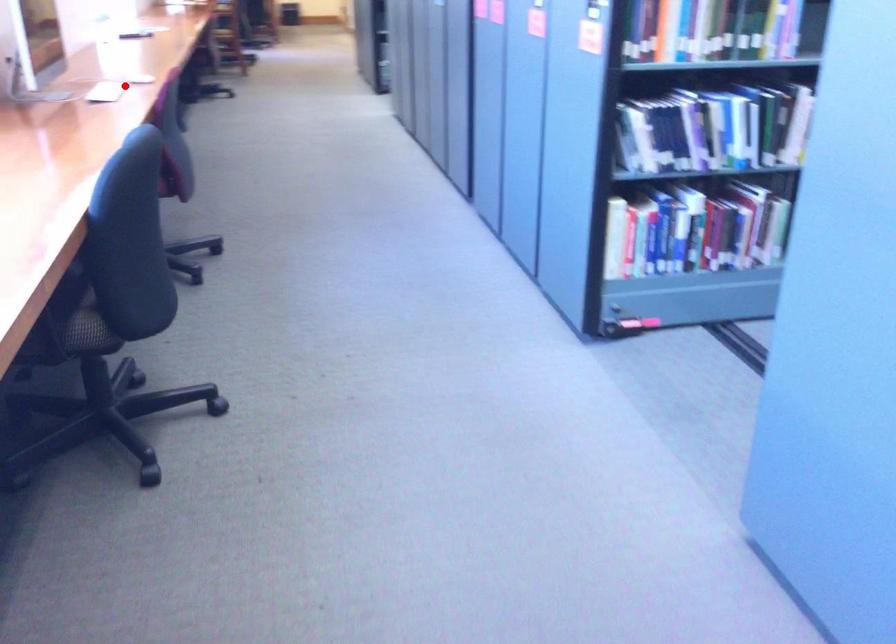
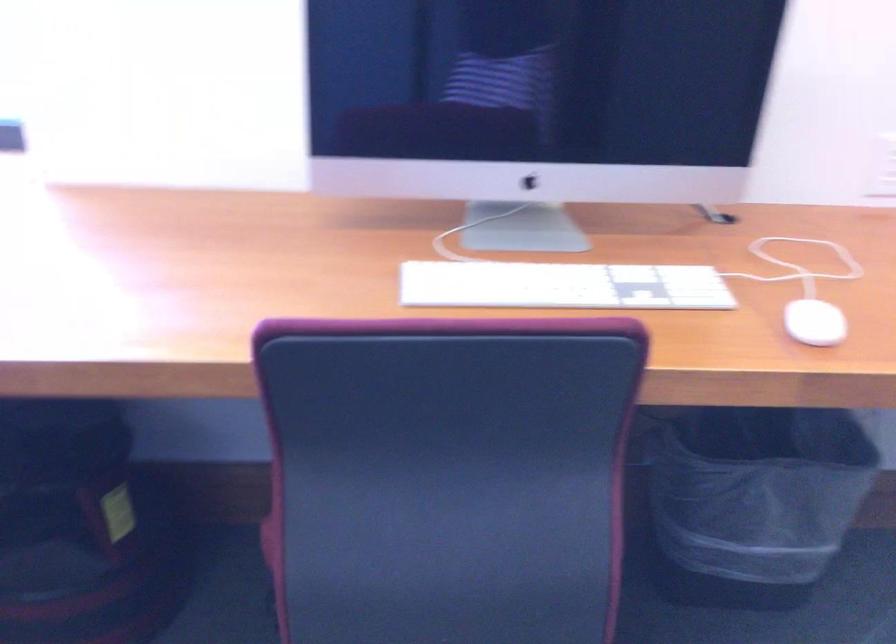
Question: I am providing you with two images of the same scene from different viewpoints. A red point is marked on the first image. At the location where the point appears in image 1, is it still visible in image 2?

Choices:
 (A) Yes
 (B) No

Answer: (A)